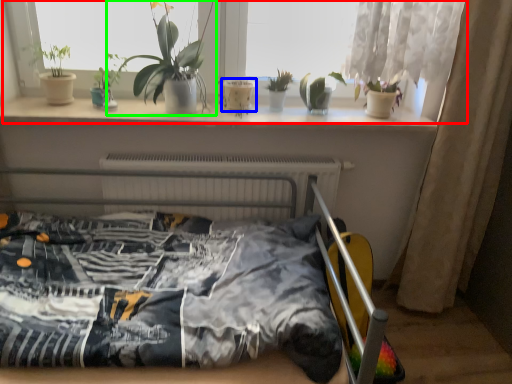
Question: Which is nearer to the window (highlighted by a red box)? flowerpot (highlighted by a blue box) or houseplant (highlighted by a green box).

Choices:
 (A) flowerpot
 (B) houseplant

Answer: (B)